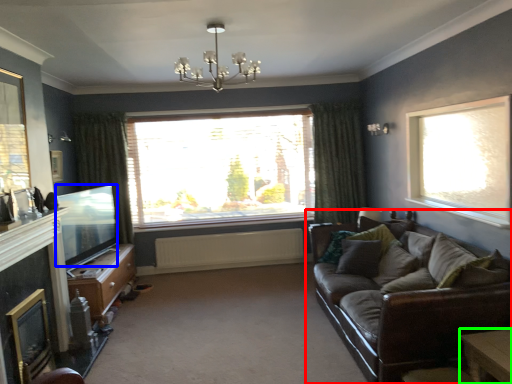
Question: Which object is positioned closest to studio couch (highlighted by a red box)? Select from window screen (highlighted by a blue box) and table (highlighted by a green box).

Choices:
 (A) window screen
 (B) table

Answer: (B)